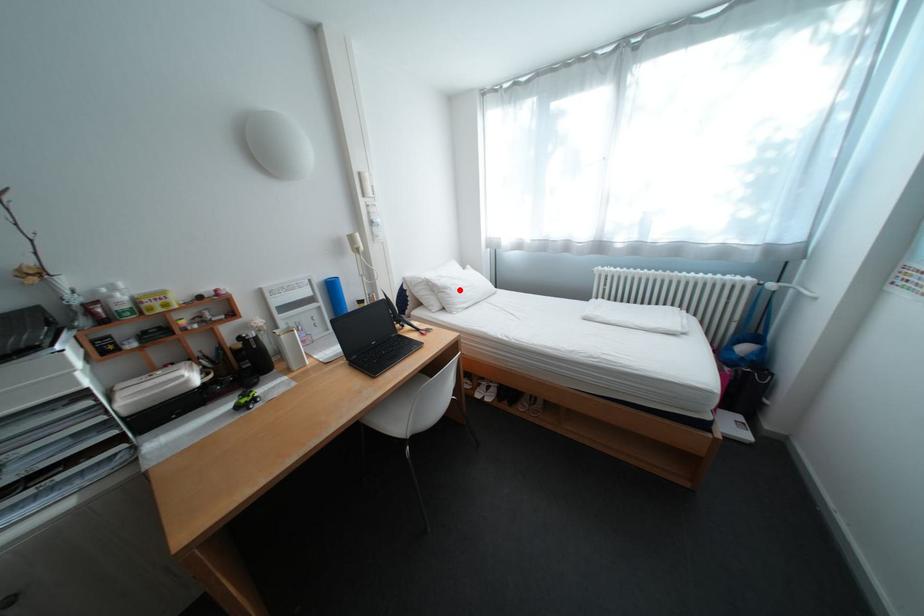
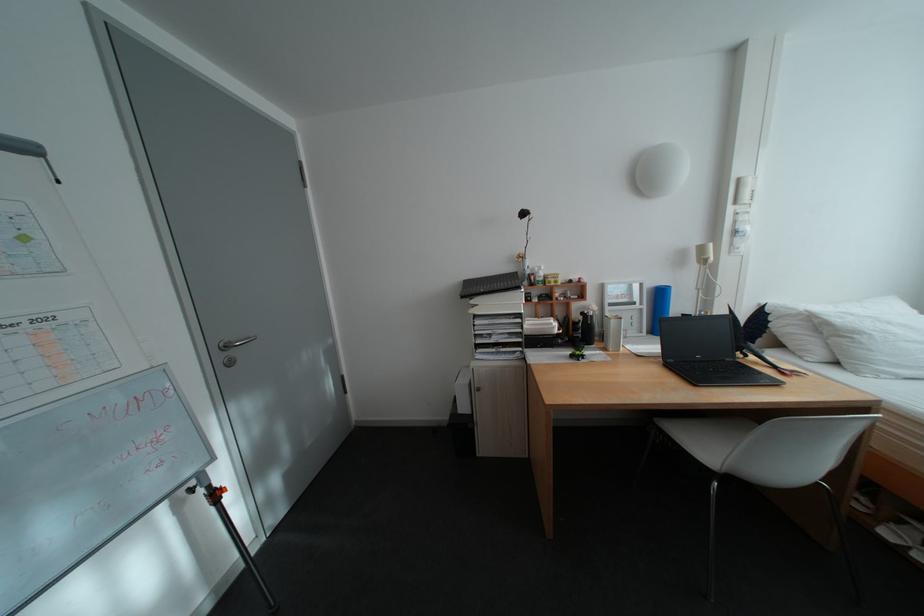
Question: I am providing you with two images of the same scene from different viewpoints. A red point is marked on the first image. Is the red point's position out of view in image 2?

Choices:
 (A) Yes
 (B) No

Answer: (B)